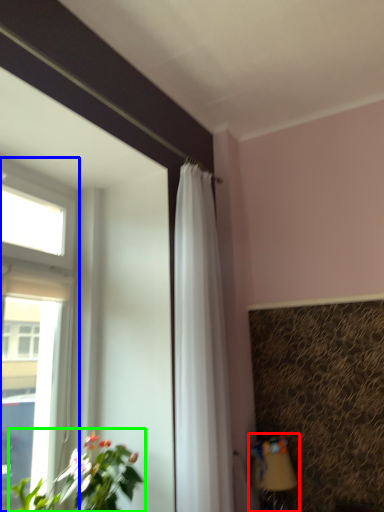
Question: Estimate the real-world distances between objects in this image. Which object is farther from table lamp (highlighted by a red box), window (highlighted by a blue box) or houseplant (highlighted by a green box)?

Choices:
 (A) window
 (B) houseplant

Answer: (A)